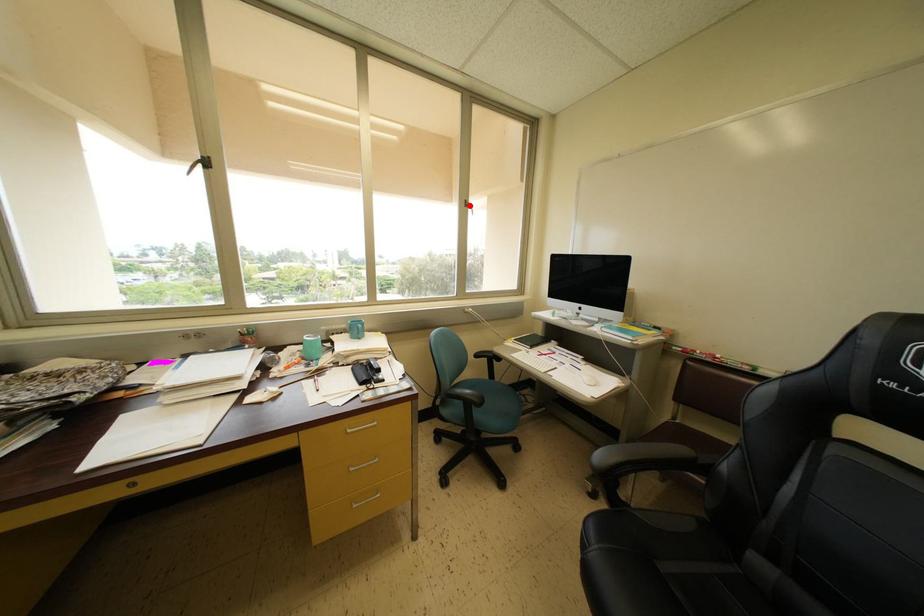
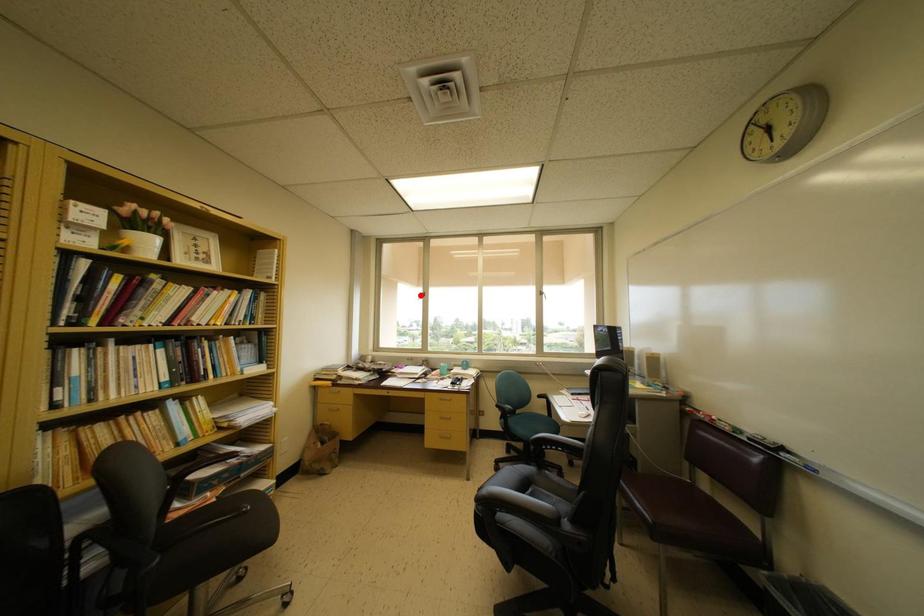
I am providing you with two images of the same scene from different viewpoints. A red point is marked on the first image and another point is marked on the second image. Does the point marked in image1 correspond to the same location as the one in image2?

No